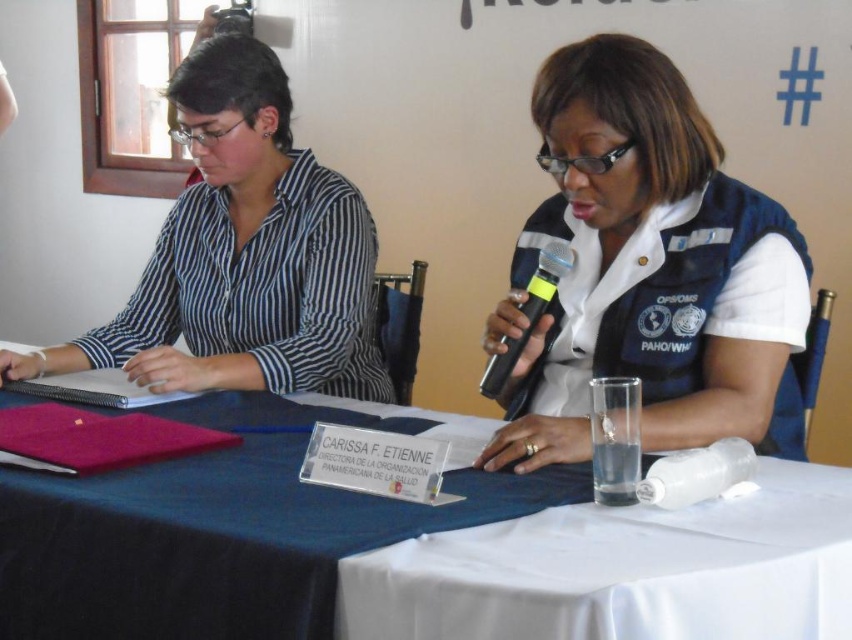
Is point (764, 262) closer to viewer compared to point (550, 260)?

Yes, point (764, 262) is in front of point (550, 260).

Can you confirm if white matte vest at center is thinner than black plastic microphone at center?

No, white matte vest at center is not thinner than black plastic microphone at center.

Identify the location of white matte vest at center. The height and width of the screenshot is (640, 852). (648, 269).

Who is positioned more to the left, white matte vest at center or matte black shirt at left?

matte black shirt at left

Where is `white matte vest at center`? The height and width of the screenshot is (640, 852). white matte vest at center is located at coordinates (648, 269).

Does white cloth at center have a smaller size compared to matte black shirt at left?

Indeed, white cloth at center has a smaller size compared to matte black shirt at left.

Does white cloth at center appear on the left side of matte black shirt at left?

No, white cloth at center is not to the left of matte black shirt at left.

Which is behind, point (177, 637) or point (355, 346)?

Point (355, 346)

The image size is (852, 640). Identify the location of white cloth at center. (222, 531).